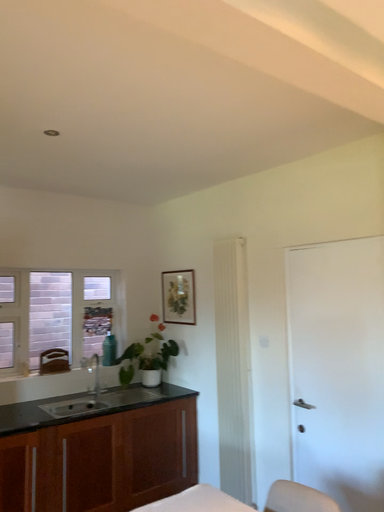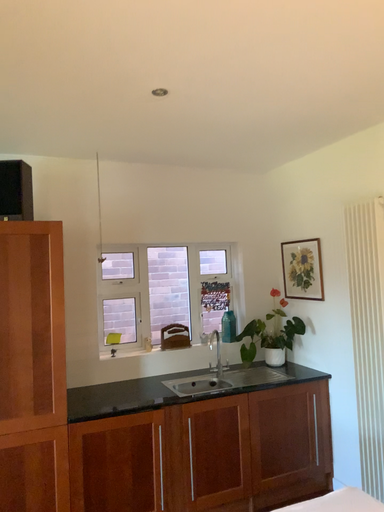
Question: Which way did the camera rotate in the video?

Choices:
 (A) rotated left
 (B) rotated right

Answer: (A)